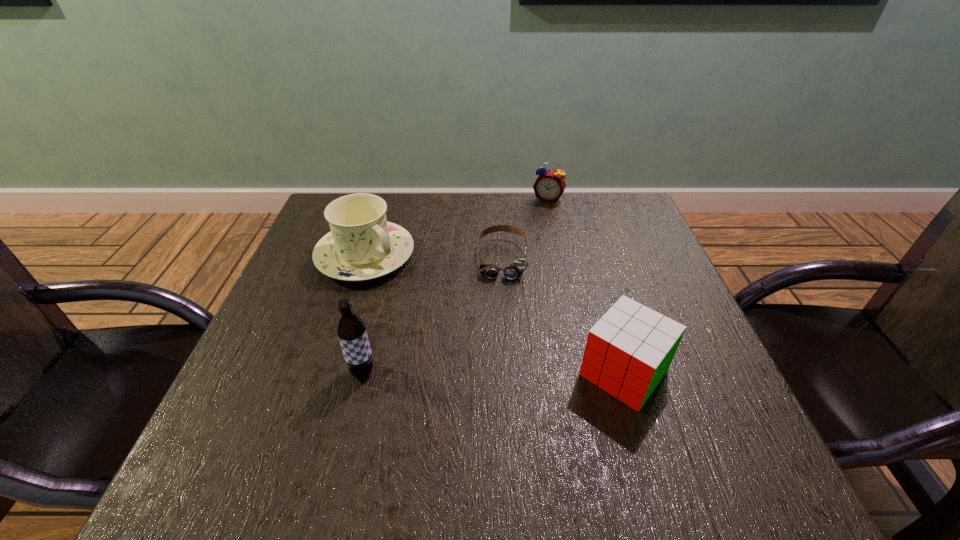
What are the coordinates of `vacant space on the desktop that is between the root beer and the cube and is positioned on the front-facing side of the third object from right to left` in the screenshot? It's located at (498, 372).

The height and width of the screenshot is (540, 960). Identify the location of vacant space on the desktop that is between the root beer and the cube and is positioned on the front-facing side of the farthest object. (471, 372).

The width and height of the screenshot is (960, 540). In order to click on vacant space on the desktop that is between the root beer and the cube and is positioned on the handle side of the chinaware in this screenshot , I will do `click(522, 373)`.